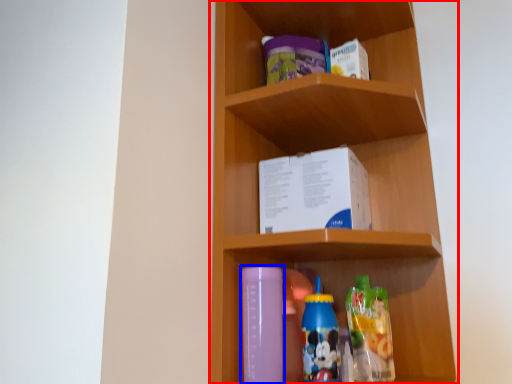
Question: Which object appears farthest to the camera in this image, shelf (highlighted by a red box) or bottle (highlighted by a blue box)?

Choices:
 (A) shelf
 (B) bottle

Answer: (B)